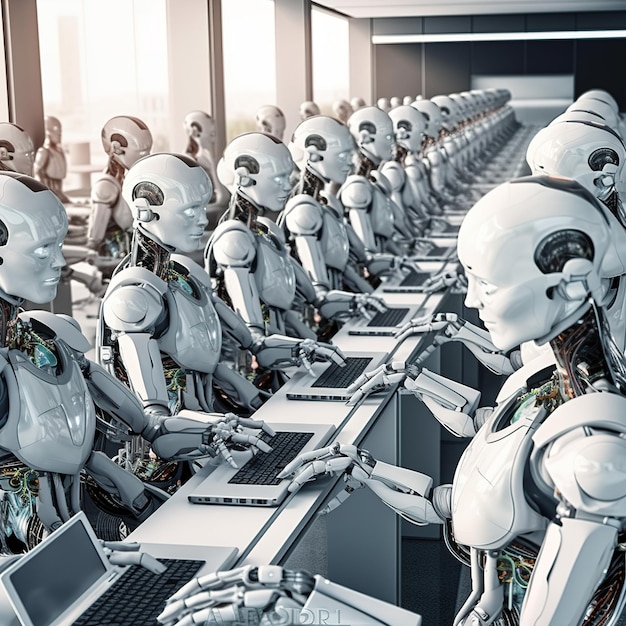
At what (x,y) coordinates should I click in order to perform the action: click on keyboards. Please return your answer as a coordinate pair (x, y). Looking at the image, I should click on (146, 596), (275, 459), (344, 372), (385, 321), (452, 230), (437, 252), (409, 284).